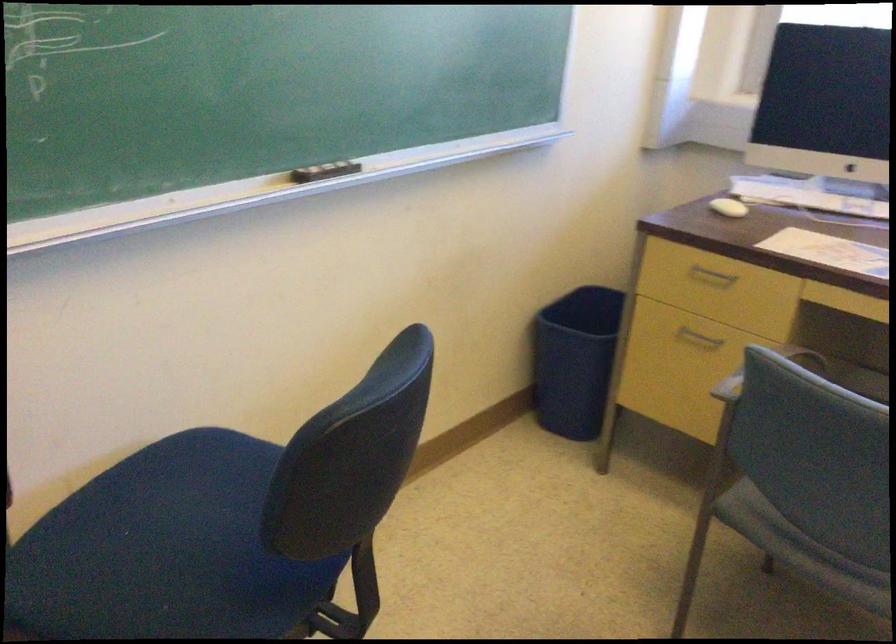
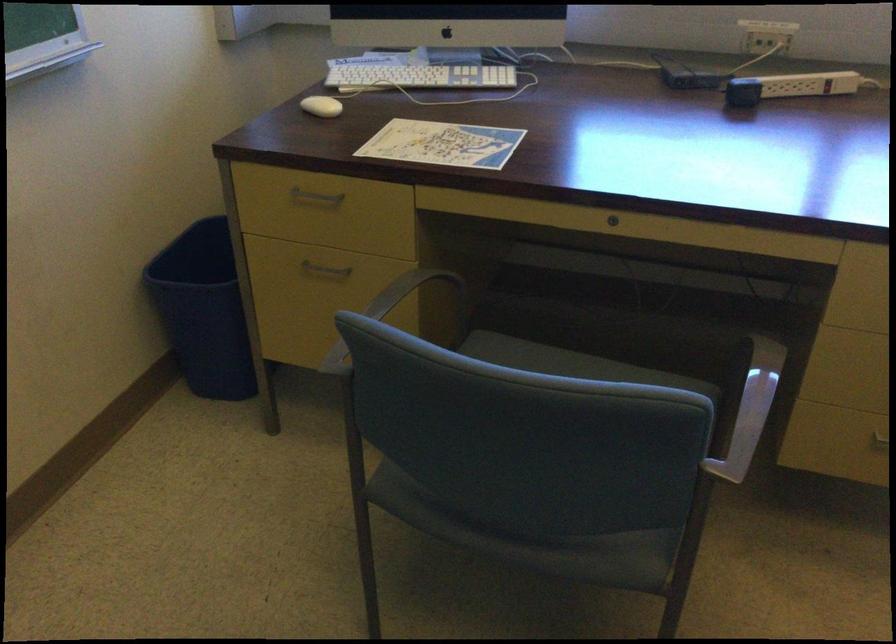
In the second image, find the point that corresponds to [718,269] in the first image.

(315, 196)